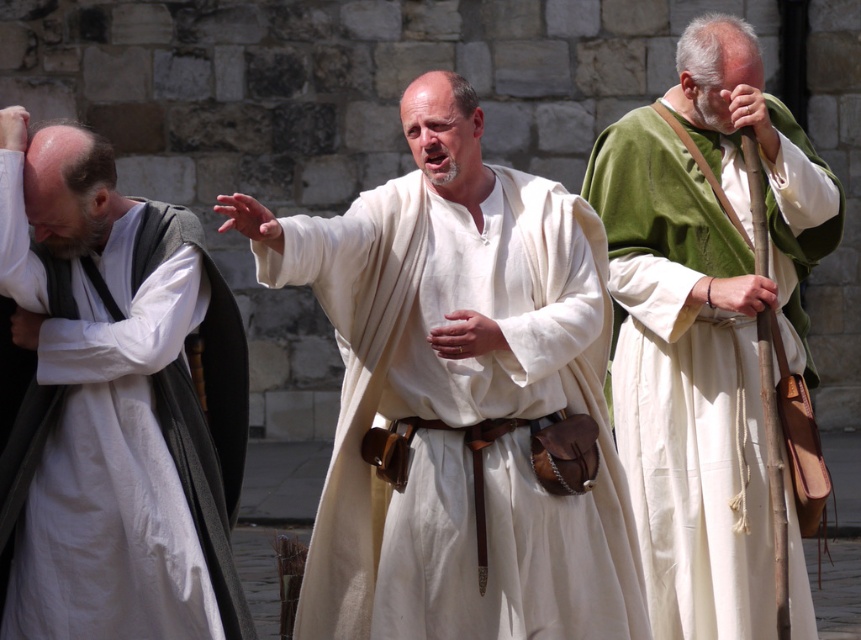
Does white clothed robe at center appear on the right side of white linen robe at left?

Indeed, white clothed robe at center is positioned on the right side of white linen robe at left.

Is white clothed robe at center taller than white linen robe at left?

Indeed, white clothed robe at center has a greater height compared to white linen robe at left.

At what (x,y) coordinates should I click in order to perform the action: click on white clothed robe at center. Please return your answer as a coordinate pair (x, y). The height and width of the screenshot is (640, 861). Looking at the image, I should click on (457, 396).

Is point (88, 486) positioned in front of point (660, 156)?

Yes, it is.

Can you confirm if white linen robe at left is taller than green velvet robe at right?

No.

Is point (242, 349) farther from viewer compared to point (639, 180)?

No, it is not.

The image size is (861, 640). I want to click on white linen robe at left, so click(113, 404).

Is white clothed robe at center behind green velvet robe at right?

That is False.

Can you confirm if white clothed robe at center is positioned to the left of green velvet robe at right?

Indeed, white clothed robe at center is positioned on the left side of green velvet robe at right.

What do you see at coordinates (457, 396) in the screenshot? This screenshot has height=640, width=861. I see `white clothed robe at center` at bounding box center [457, 396].

Where is `white clothed robe at center`? The height and width of the screenshot is (640, 861). white clothed robe at center is located at coordinates (457, 396).